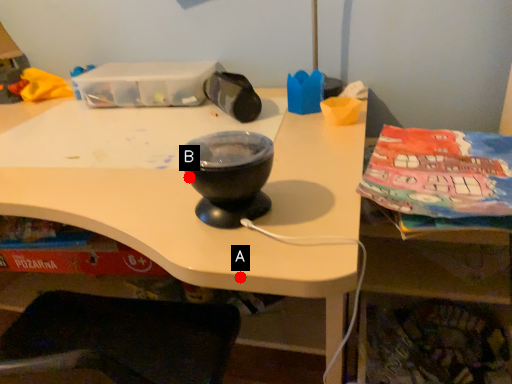
Question: Two points are circled on the image, labeled by A and B beside each circle. Which point appears closest to the camera in this image?

Choices:
 (A) A is closer
 (B) B is closer

Answer: (A)